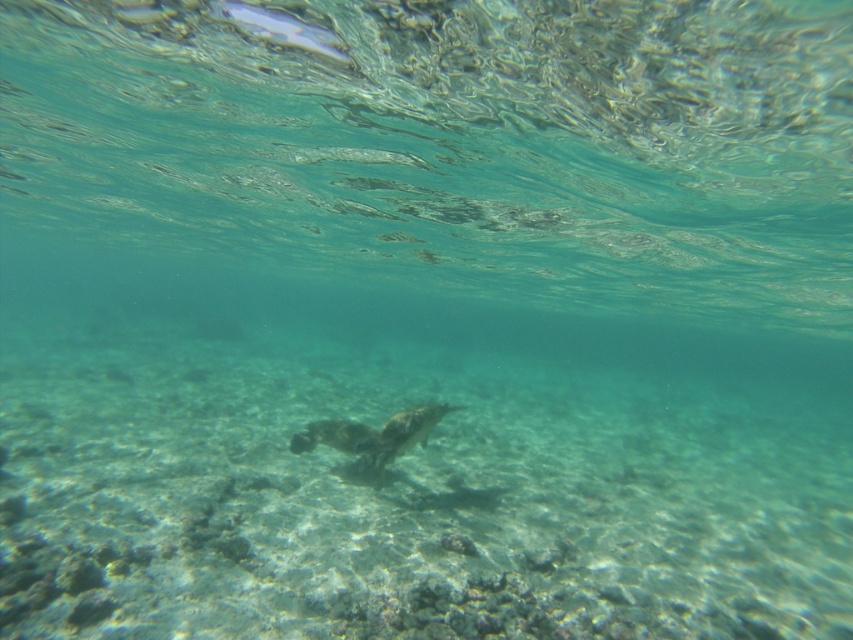
Can you confirm if camouflage-patterned fish at center is positioned below translucent glassy fish at upper center?

Yes.

Does camouflage-patterned fish at center appear over translucent glassy fish at upper center?

No.

Between point (339, 451) and point (267, 13), which one is positioned behind?

Positioned behind is point (339, 451).

I want to click on camouflage-patterned fish at center, so click(374, 435).